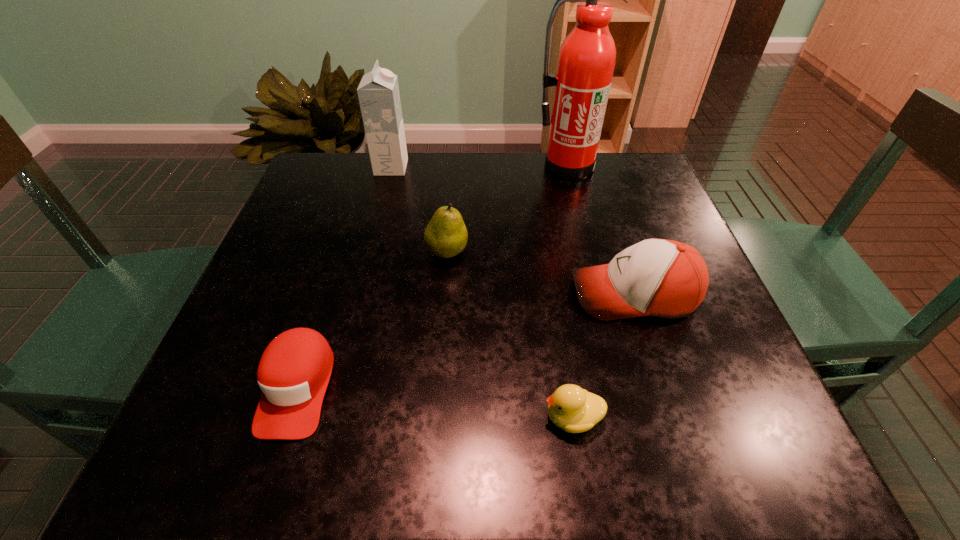
Locate an element on the screen. fire extinguisher is located at coordinates click(586, 61).

Locate an element on the screen. carton is located at coordinates (378, 93).

Locate an element on the screen. pear is located at coordinates (446, 235).

Identify the location of the third object from left to right. Image resolution: width=960 pixels, height=540 pixels. (446, 235).

At what (x,y) coordinates should I click in order to perform the action: click on the farther baseball cap. Please return your answer as a coordinate pair (x, y). Looking at the image, I should click on (663, 278).

Where is `the right baseball cap`? This screenshot has width=960, height=540. the right baseball cap is located at coordinates (663, 278).

Image resolution: width=960 pixels, height=540 pixels. Find the location of `duckling`. duckling is located at coordinates (573, 409).

At what (x,y) coordinates should I click in order to perform the action: click on the shorter baseball cap. Please return your answer as a coordinate pair (x, y). Looking at the image, I should click on (294, 371).

Find the location of a particular element. Image resolution: width=960 pixels, height=540 pixels. the nearer baseball cap is located at coordinates (294, 371).

In order to click on vacant area located on the label side of the fire extinguisher in this screenshot , I will do `click(574, 197)`.